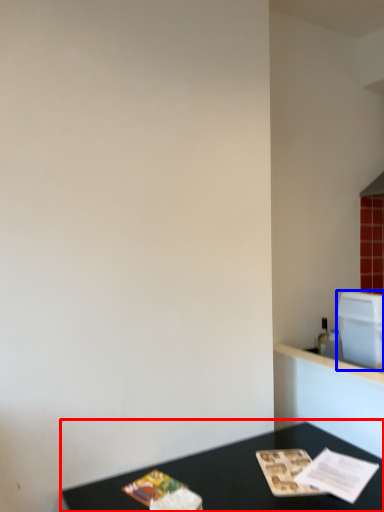
Question: Which of the following is the closest to the observer, table (highlighted by a red box) or appliance (highlighted by a blue box)?

Choices:
 (A) table
 (B) appliance

Answer: (A)